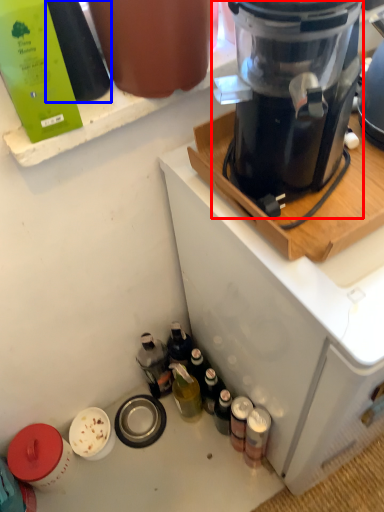
Question: Which point is further to the camera, blender (highlighted by a red box) or bottle (highlighted by a blue box)?

Choices:
 (A) blender
 (B) bottle

Answer: (B)